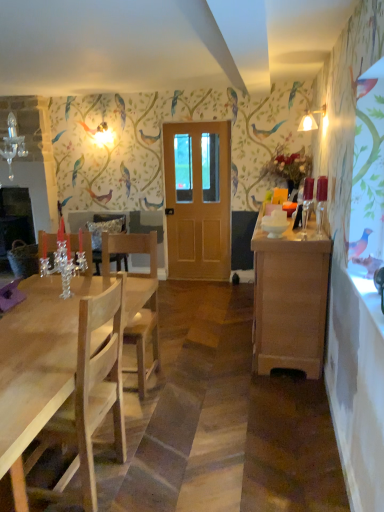
Question: From the image's perspective, does natural wood chair at left, acting as the 1th chair starting from the back, appear higher than light brown wooden door at center?

Choices:
 (A) yes
 (B) no

Answer: (B)

Question: Does natural wood chair at left, acting as the 1th chair starting from the back, have a lesser width compared to light brown wooden door at center?

Choices:
 (A) no
 (B) yes

Answer: (A)

Question: From the image's perspective, is natural wood chair at left, placed as the 2th chair when sorted from front to back, below light brown wooden door at center?

Choices:
 (A) no
 (B) yes

Answer: (B)

Question: Does natural wood chair at left, placed as the 2th chair when sorted from front to back, touch light brown wooden door at center?

Choices:
 (A) yes
 (B) no

Answer: (B)

Question: From a real-world perspective, is natural wood chair at left, placed as the 2th chair when sorted from front to back, physically above light brown wooden door at center?

Choices:
 (A) no
 (B) yes

Answer: (A)

Question: Can you confirm if natural wood chair at left, acting as the 1th chair starting from the back, is smaller than light brown wooden door at center?

Choices:
 (A) yes
 (B) no

Answer: (B)

Question: Can you confirm if light wood chair at left, the 2th chair when ordered from back to front, is smaller than light brown wooden door at center?

Choices:
 (A) no
 (B) yes

Answer: (A)

Question: From a real-world perspective, is light wood chair at left, the 2th chair when ordered from back to front, below light brown wooden door at center?

Choices:
 (A) no
 (B) yes

Answer: (B)

Question: From the image's perspective, is light wood chair at left, the 2th chair when ordered from back to front, on light brown wooden door at center?

Choices:
 (A) yes
 (B) no

Answer: (B)

Question: Is the surface of light wood chair at left, the 2th chair when ordered from back to front, in direct contact with light brown wooden door at center?

Choices:
 (A) no
 (B) yes

Answer: (A)

Question: Is light wood chair at left, the 2th chair when ordered from back to front, behind light brown wooden door at center?

Choices:
 (A) no
 (B) yes

Answer: (A)

Question: Does light wood chair at left, the 2th chair when ordered from back to front, appear on the left side of light brown wooden door at center?

Choices:
 (A) no
 (B) yes

Answer: (B)

Question: Can you see wooden cabinet at right touching matte white lampshade at upper right?

Choices:
 (A) yes
 (B) no

Answer: (B)